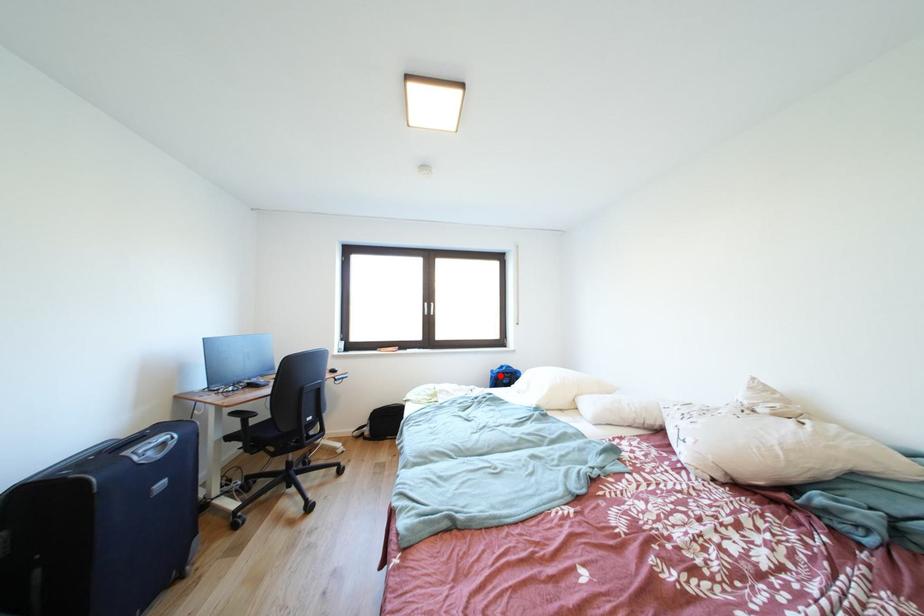
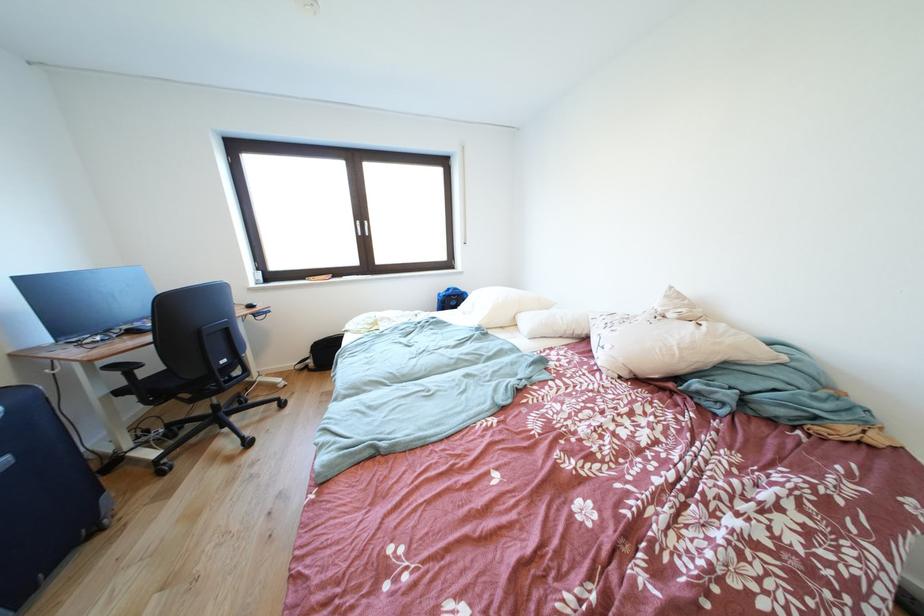
In the second image, find the point that corresponds to the highlighted location in the first image.

(447, 299)